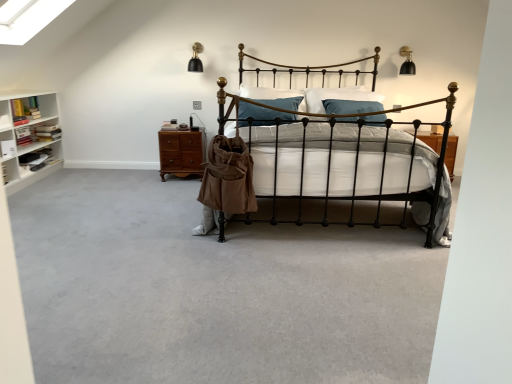
Question: Considering the relative sizes of brown wood drawer at center and black wrought iron bed at center in the image provided, is brown wood drawer at center bigger than black wrought iron bed at center?

Choices:
 (A) no
 (B) yes

Answer: (A)

Question: Is brown wood drawer at center shorter than black wrought iron bed at center?

Choices:
 (A) no
 (B) yes

Answer: (B)

Question: Is black wrought iron bed at center surrounded by brown wood drawer at center?

Choices:
 (A) yes
 (B) no

Answer: (B)

Question: From a real-world perspective, is brown wood drawer at center physically above black wrought iron bed at center?

Choices:
 (A) no
 (B) yes

Answer: (A)

Question: Does brown wood drawer at center have a lesser width compared to black wrought iron bed at center?

Choices:
 (A) yes
 (B) no

Answer: (A)

Question: From the image's perspective, is brown wood drawer at center on top of black wrought iron bed at center?

Choices:
 (A) no
 (B) yes

Answer: (B)

Question: Does brown wood drawer at center touch tan canvas bag at center?

Choices:
 (A) no
 (B) yes

Answer: (A)

Question: Is brown wood drawer at center at the right side of tan canvas bag at center?

Choices:
 (A) no
 (B) yes

Answer: (A)

Question: Is brown wood drawer at center surrounding tan canvas bag at center?

Choices:
 (A) no
 (B) yes

Answer: (A)

Question: From a real-world perspective, is brown wood drawer at center physically above tan canvas bag at center?

Choices:
 (A) no
 (B) yes

Answer: (A)

Question: From the image's perspective, does brown wood drawer at center appear higher than tan canvas bag at center?

Choices:
 (A) yes
 (B) no

Answer: (A)

Question: Considering the relative positions of brown wood drawer at center and tan canvas bag at center in the image provided, is brown wood drawer at center behind tan canvas bag at center?

Choices:
 (A) yes
 (B) no

Answer: (A)

Question: Considering the relative sizes of gray carpet at center and tan canvas bag at center in the image provided, is gray carpet at center thinner than tan canvas bag at center?

Choices:
 (A) no
 (B) yes

Answer: (A)